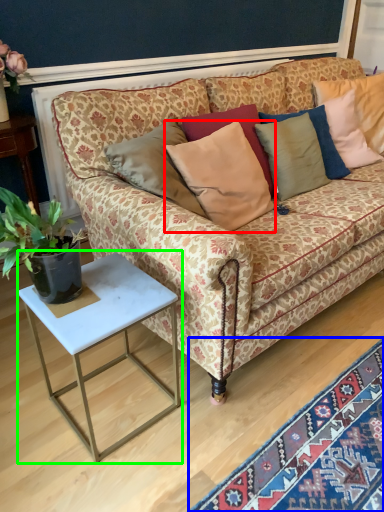
Question: Based on their relative distances, which object is nearer to pillow (highlighted by a red box)? Choose from mat (highlighted by a blue box) and table (highlighted by a green box).

Choices:
 (A) mat
 (B) table

Answer: (B)